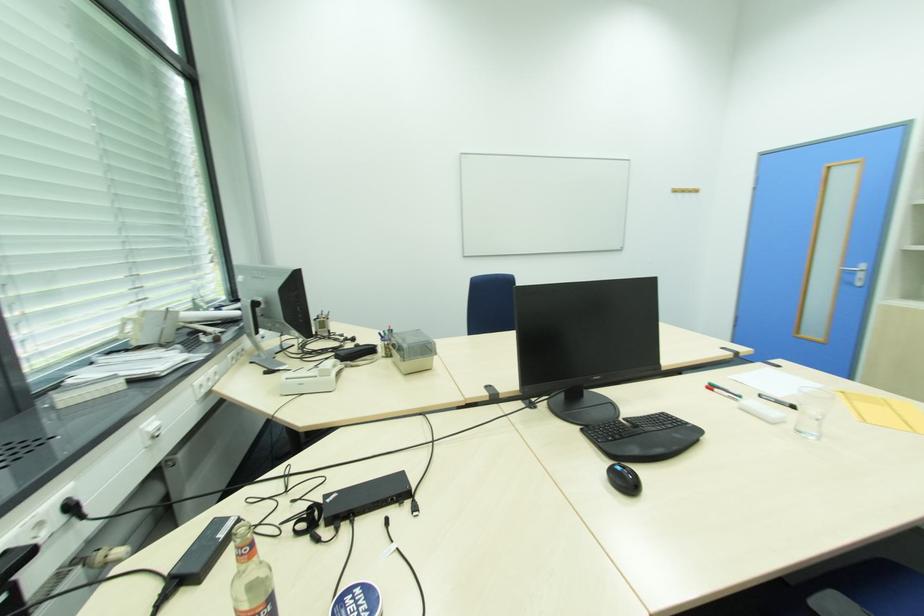
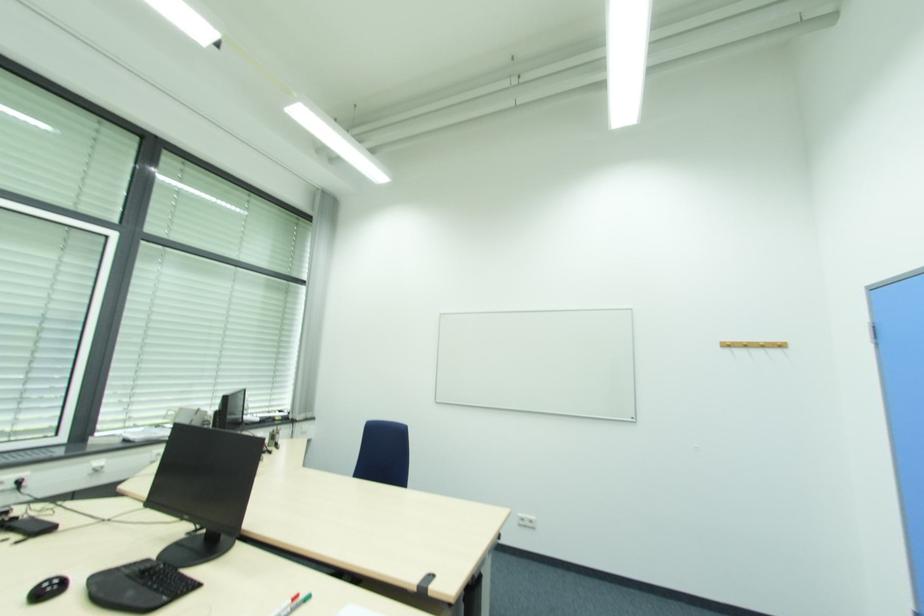
Locate, in the second image, the point that corresponds to [678,192] in the first image.

(730, 346)